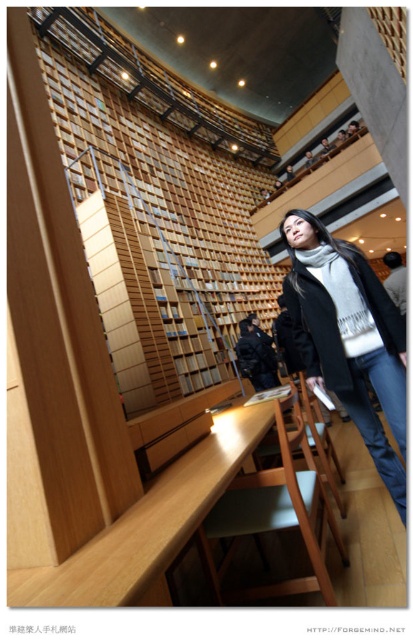
You are a customer in the library and see the dark blue jacket at center and the matte black jacket at upper center. Which jacket is closer to the floor?

The dark blue jacket at center is closer to the floor because it is positioned under the matte black jacket at upper center.

You are a visitor in the library and want to sit down at the wooden chair at center. However, there is a dark blue jacket at center in the way. Can you sit down without moving the jacket?

The wooden chair at center is in front of the dark blue jacket at center, meaning the jacket is behind the chair. Therefore, you can sit down without moving the jacket as it is not blocking the chair.